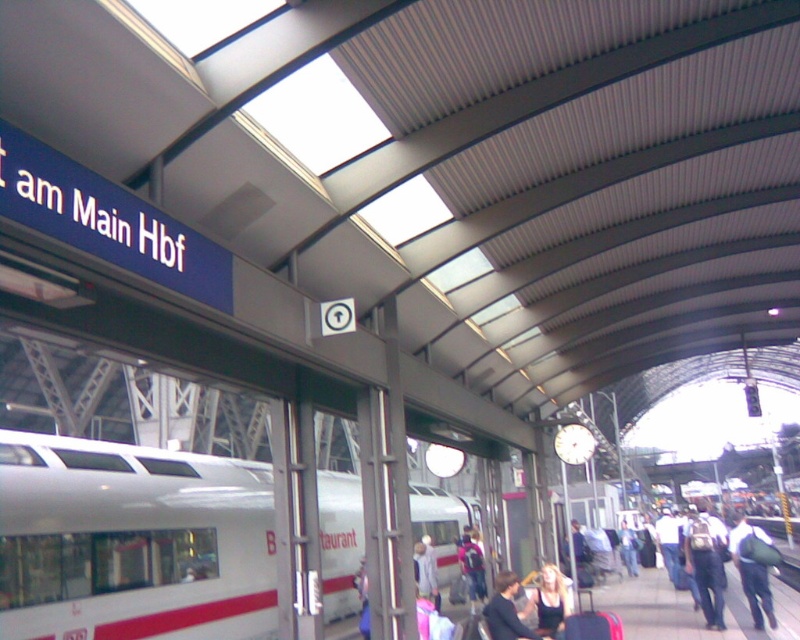
Find the location of `dark blue backpack at lower right`. dark blue backpack at lower right is located at coordinates (704, 568).

Which of these two, dark blue backpack at lower right or matte black shirt at center, stands taller?

With more height is dark blue backpack at lower right.

Which is behind, point (717, 598) or point (552, 568)?

Point (717, 598)

You are a GUI agent. You are given a task and a screenshot of the screen. Output one action in this format:
    pyautogui.click(x=<x>, y=<y>)
    Task: Click on the dark blue backpack at lower right
    The width and height of the screenshot is (800, 640).
    Given the screenshot: What is the action you would take?
    pyautogui.click(x=704, y=568)

Which is more to the right, white glossy train at left or matte black shirt at center?

Positioned to the right is matte black shirt at center.

How far apart are white glossy train at left and matte black shirt at center?

They are 9.07 meters apart.

Does point (330, 522) come farther from viewer compared to point (552, 580)?

Yes, point (330, 522) is behind point (552, 580).

Locate an element on the screen. white glossy train at left is located at coordinates (132, 541).

Identify the location of dark blue backpack at lower right. Image resolution: width=800 pixels, height=640 pixels. (704, 568).

Is dark blue backpack at lower right above dark brown leather jacket at lower center?

No.

Does point (720, 579) lie in front of point (514, 625)?

No, it is not.

This screenshot has height=640, width=800. What are the coordinates of `dark blue backpack at lower right` in the screenshot? It's located at (704, 568).